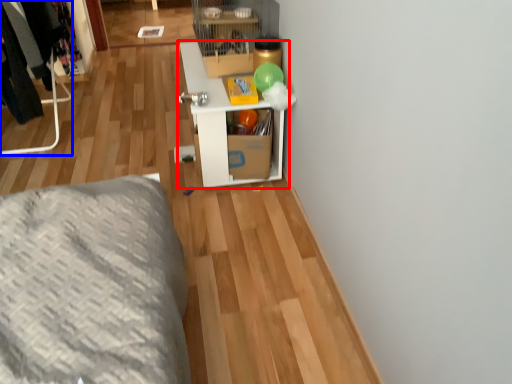
Question: Which object is closer to the camera taking this photo, shelf (highlighted by a red box) or furniture (highlighted by a blue box)?

Choices:
 (A) shelf
 (B) furniture

Answer: (A)